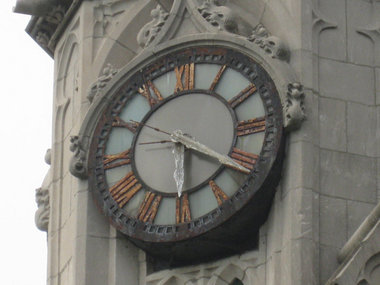
Identify the location of clock. (212, 118).